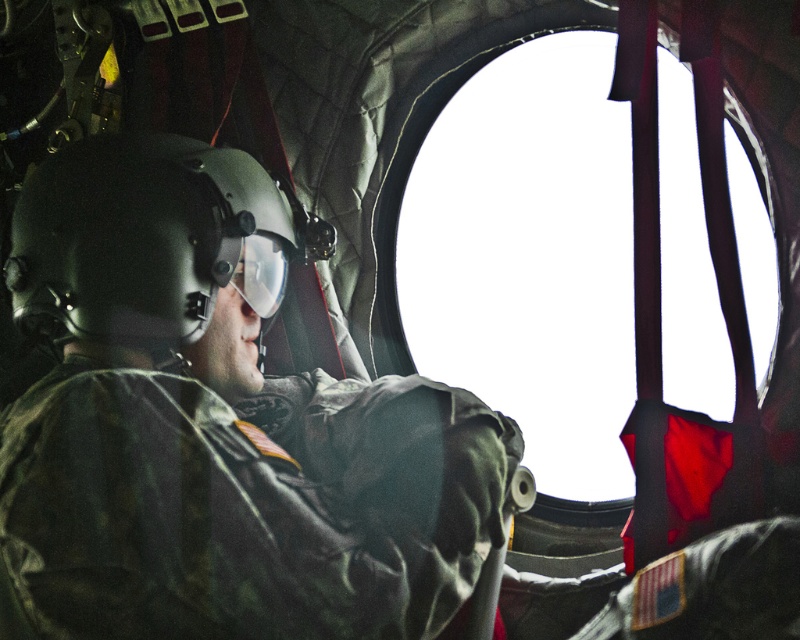
Question: Among these objects, which one is nearest to the camera?

Choices:
 (A) transparent glass window at center
 (B) matte black helmet at center

Answer: (B)

Question: Is matte black helmet at center positioned at the back of transparent glass window at center?

Choices:
 (A) no
 (B) yes

Answer: (A)

Question: In this image, where is matte black helmet at center located relative to transparent glass window at center?

Choices:
 (A) below
 (B) above

Answer: (A)

Question: Where is matte black helmet at center located in relation to transparent glass window at center in the image?

Choices:
 (A) above
 (B) below

Answer: (B)

Question: Which point is farther to the camera?

Choices:
 (A) (528, 58)
 (B) (345, 448)

Answer: (A)